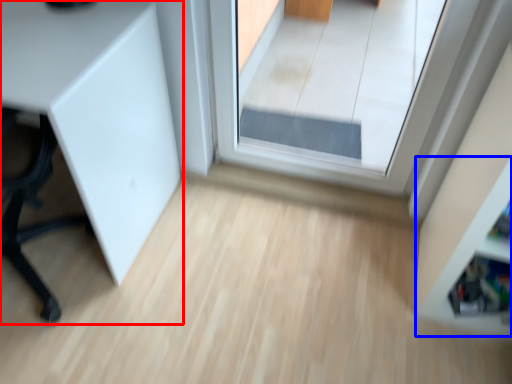
Question: Which object appears closest to the camera in this image, furniture (highlighted by a red box) or shelf (highlighted by a blue box)?

Choices:
 (A) furniture
 (B) shelf

Answer: (B)